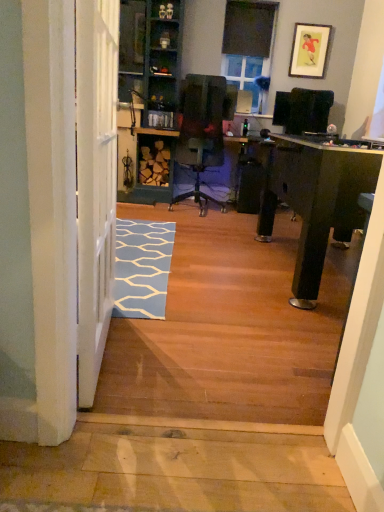
Question: From the image's perspective, is blue carpet at lower left located above or below matte gold picture frame at upper right?

Choices:
 (A) below
 (B) above

Answer: (A)

Question: Based on their sizes in the image, would you say blue carpet at lower left is bigger or smaller than matte gold picture frame at upper right?

Choices:
 (A) small
 (B) big

Answer: (B)

Question: Which of these objects is positioned farthest from the matte gold picture frame at upper right?

Choices:
 (A) blue carpet at lower left
 (B) black matte window screen at upper center, the second window screen when ordered from back to front
 (C) clear glass window screen at upper center, the 1th window screen positioned from the back
 (D) green painted wood bookshelf at center

Answer: (A)

Question: Which is nearer to the matte gold picture frame at upper right?

Choices:
 (A) green painted wood bookshelf at center
 (B) clear glass window screen at upper center, the second window screen positioned from the top
 (C) blue carpet at lower left
 (D) black matte window screen at upper center, the second window screen when ordered from back to front

Answer: (D)